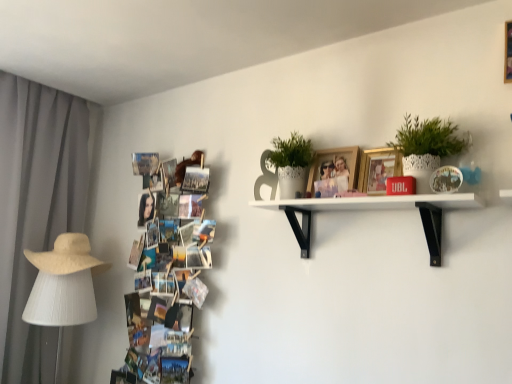
Question: Can we say white matte shelf at upper center lies outside white fabric lampshade at left?

Choices:
 (A) no
 (B) yes

Answer: (B)

Question: Can you confirm if white matte shelf at upper center is smaller than white fabric lampshade at left?

Choices:
 (A) no
 (B) yes

Answer: (B)

Question: Is white matte shelf at upper center oriented away from white fabric lampshade at left?

Choices:
 (A) yes
 (B) no

Answer: (B)

Question: Is the position of white matte shelf at upper center more distant than that of white fabric lampshade at left?

Choices:
 (A) no
 (B) yes

Answer: (A)

Question: Is white matte shelf at upper center with white fabric lampshade at left?

Choices:
 (A) no
 (B) yes

Answer: (A)

Question: From the image's perspective, is white matte shelf at upper center above white fabric lampshade at left?

Choices:
 (A) no
 (B) yes

Answer: (B)

Question: Is gold metallic picture frame at upper center, which is counted as the 2th picture frame, starting from the left, taller than white fabric lampshade at left?

Choices:
 (A) no
 (B) yes

Answer: (A)

Question: From a real-world perspective, is gold metallic picture frame at upper center, which is counted as the 2th picture frame, starting from the left, below white fabric lampshade at left?

Choices:
 (A) no
 (B) yes

Answer: (A)

Question: Does gold metallic picture frame at upper center, the first picture frame when ordered from right to left, appear on the right side of white fabric lampshade at left?

Choices:
 (A) yes
 (B) no

Answer: (A)

Question: Does gold metallic picture frame at upper center, which is counted as the 2th picture frame, starting from the left, have a lesser height compared to white fabric lampshade at left?

Choices:
 (A) yes
 (B) no

Answer: (A)

Question: Does gold metallic picture frame at upper center, which is counted as the 2th picture frame, starting from the left, appear on the left side of white fabric lampshade at left?

Choices:
 (A) no
 (B) yes

Answer: (A)

Question: Can you confirm if gold metallic picture frame at upper center, which is counted as the 2th picture frame, starting from the left, is wider than white fabric lampshade at left?

Choices:
 (A) no
 (B) yes

Answer: (A)

Question: Does beige straw hat at left have a larger size compared to white textured pot at upper right, marked as the 2th houseplant in a back-to-front arrangement?

Choices:
 (A) no
 (B) yes

Answer: (B)